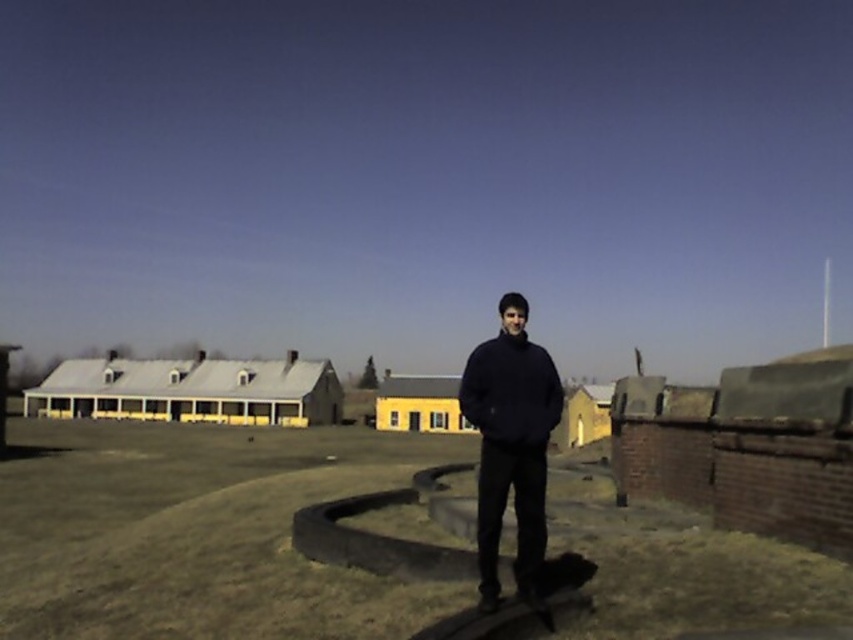
Question: Considering the relative positions of dark blue sweater at center and black matte sweatshirt at center in the image provided, where is dark blue sweater at center located with respect to black matte sweatshirt at center?

Choices:
 (A) below
 (B) above

Answer: (B)

Question: Where is dark blue sweater at center located in relation to black matte sweatshirt at center in the image?

Choices:
 (A) above
 (B) below

Answer: (A)

Question: Among these objects, which one is farthest from the camera?

Choices:
 (A) dark blue sweater at center
 (B) black matte sweatshirt at center

Answer: (A)

Question: Considering the relative positions of dark blue sweater at center and black matte sweatshirt at center in the image provided, where is dark blue sweater at center located with respect to black matte sweatshirt at center?

Choices:
 (A) left
 (B) right

Answer: (A)